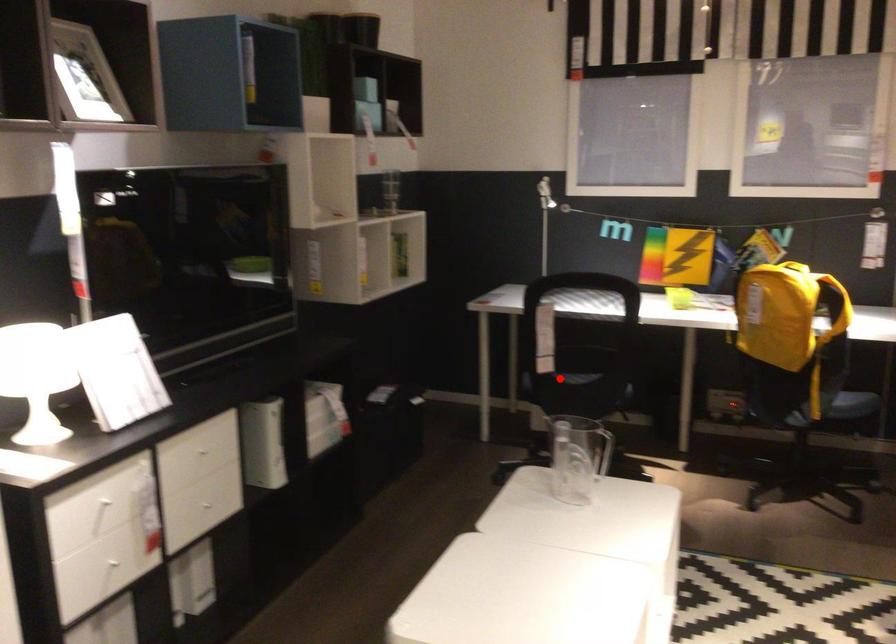
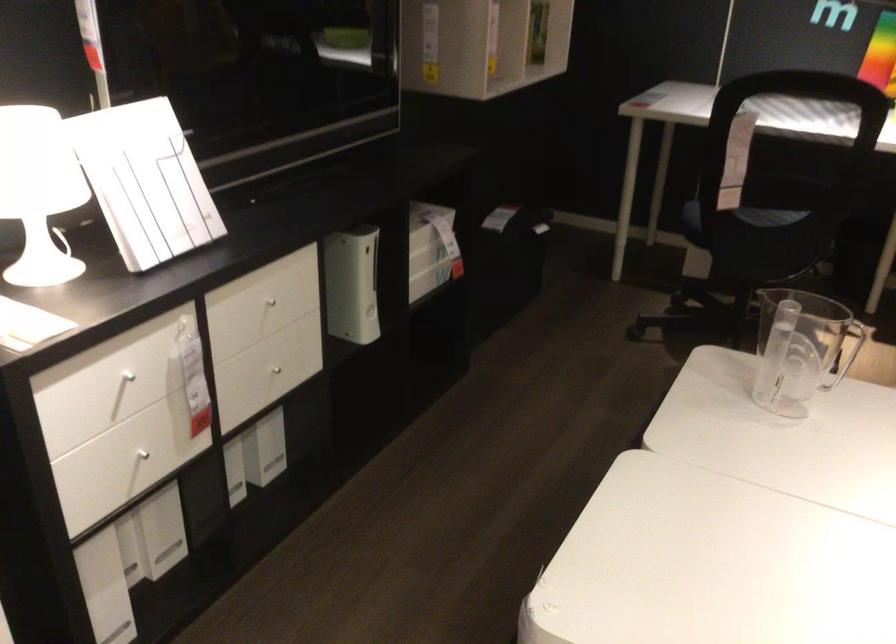
Question: A red point is marked in image1. In image2, is the corresponding 3D point closer to the camera or farther? Reply with the corresponding letter.

Choices:
 (A) The corresponding 3D point is closer.
 (B) The corresponding 3D point is farther.

Answer: (A)